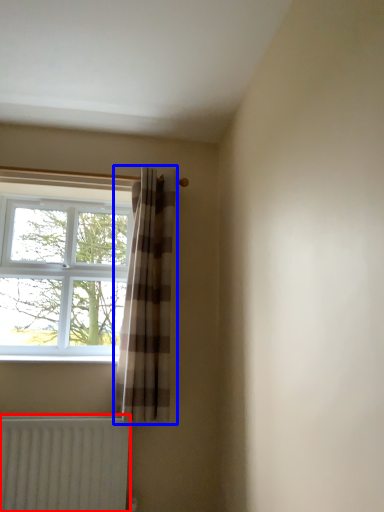
Question: Which object appears farthest to the camera in this image, radiator (highlighted by a red box) or curtain (highlighted by a blue box)?

Choices:
 (A) radiator
 (B) curtain

Answer: (B)